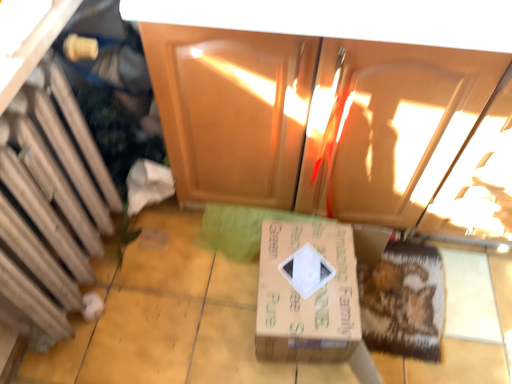
Question: Can you confirm if brown cardboard box at center is thinner than wooden cabinet at left, which appears as the 1th cabinetry when viewed from the left?

Choices:
 (A) no
 (B) yes

Answer: (A)

Question: Does brown cardboard box at center have a smaller size compared to wooden cabinet at left, which appears as the 1th cabinetry when viewed from the left?

Choices:
 (A) no
 (B) yes

Answer: (B)

Question: Can you confirm if brown cardboard box at center is positioned to the left of wooden cabinet at left, placed as the second cabinetry when sorted from right to left?

Choices:
 (A) yes
 (B) no

Answer: (B)

Question: Does brown cardboard box at center turn towards wooden cabinet at left, placed as the second cabinetry when sorted from right to left?

Choices:
 (A) no
 (B) yes

Answer: (A)

Question: From the image's perspective, would you say brown cardboard box at center is shown under wooden cabinet at left, placed as the second cabinetry when sorted from right to left?

Choices:
 (A) no
 (B) yes

Answer: (B)

Question: From the image's perspective, is matte wood cabinet at center, acting as the first cabinetry starting from the right, located above or below brown cardboard box at center?

Choices:
 (A) above
 (B) below

Answer: (A)

Question: In terms of height, does matte wood cabinet at center, the 2th cabinetry viewed from the left, look taller or shorter compared to brown cardboard box at center?

Choices:
 (A) tall
 (B) short

Answer: (A)

Question: Is point (242, 170) positioned closer to the camera than point (330, 278)?

Choices:
 (A) farther
 (B) closer

Answer: (A)

Question: Looking at the image, does matte wood cabinet at center, the 2th cabinetry viewed from the left, seem bigger or smaller compared to brown cardboard box at center?

Choices:
 (A) big
 (B) small

Answer: (A)

Question: Based on their sizes in the image, would you say matte wood cabinet at center, the 2th cabinetry viewed from the left, is bigger or smaller than wooden cabinet at left, which appears as the 1th cabinetry when viewed from the left?

Choices:
 (A) small
 (B) big

Answer: (B)

Question: Is point (390, 205) closer or farther from the camera than point (31, 51)?

Choices:
 (A) farther
 (B) closer

Answer: (A)

Question: From a real-world perspective, is matte wood cabinet at center, the 2th cabinetry viewed from the left, positioned above or below wooden cabinet at left, placed as the second cabinetry when sorted from right to left?

Choices:
 (A) above
 (B) below

Answer: (A)

Question: In the image, is matte wood cabinet at center, the 2th cabinetry viewed from the left, positioned in front of or behind wooden cabinet at left, which appears as the 1th cabinetry when viewed from the left?

Choices:
 (A) behind
 (B) front

Answer: (A)

Question: From a real-world perspective, is wooden cabinet at left, which appears as the 1th cabinetry when viewed from the left, physically located above or below brown cardboard box at center?

Choices:
 (A) below
 (B) above

Answer: (B)

Question: In the image, is wooden cabinet at left, which appears as the 1th cabinetry when viewed from the left, positioned in front of or behind brown cardboard box at center?

Choices:
 (A) front
 (B) behind

Answer: (A)